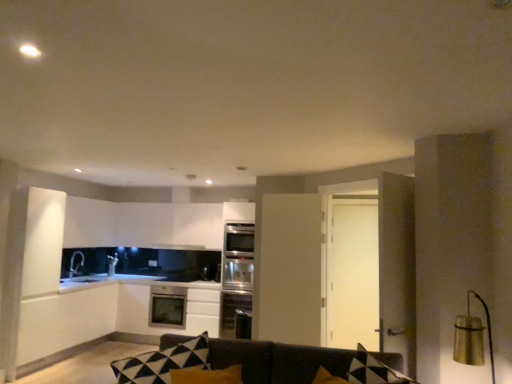
Describe the element at coordinates (167, 306) in the screenshot. I see `satin silver dishwasher at center` at that location.

Where is `satin silver dishwasher at center`? satin silver dishwasher at center is located at coordinates (167, 306).

This screenshot has width=512, height=384. What do you see at coordinates (472, 337) in the screenshot?
I see `gold metallic lampshade at right` at bounding box center [472, 337].

Measure the distance between point (468, 324) and camera.

Point (468, 324) is 8.06 feet from camera.

The image size is (512, 384). What do you see at coordinates (238, 257) in the screenshot?
I see `satin silver oven at center` at bounding box center [238, 257].

What do you see at coordinates (207, 272) in the screenshot? I see `satin black microwave at center` at bounding box center [207, 272].

I want to click on satin silver dishwasher at center, so click(x=167, y=306).

Find the location of a particular element. This screenshot has height=384, width=512. studio couch that is above the satin black microwave at center (from the image's perspective) is located at coordinates (274, 360).

Looking at this image, which is correct: satin black microwave at center is inside dark gray fabric couch at center, or outside of it?

satin black microwave at center is not enclosed by dark gray fabric couch at center.

From a real-world perspective, is satin black microwave at center located beneath dark gray fabric couch at center?

Actually, satin black microwave at center is physically above dark gray fabric couch at center in the real world.

From the image's perspective, which object appears higher, satin black microwave at center or dark gray fabric couch at center?

dark gray fabric couch at center, from the image's perspective.

Between black matte exhaust hood at upper center and satin white oven at center, which one is positioned behind?

black matte exhaust hood at upper center is more distant.

Is black matte exhaust hood at upper center oriented away from satin white oven at center?

That's not correct — black matte exhaust hood at upper center is not looking away from satin white oven at center.

Is black matte exhaust hood at upper center at the right side of satin white oven at center?

Correct, you'll find black matte exhaust hood at upper center to the right of satin white oven at center.

Between black matte exhaust hood at upper center and satin white oven at center, which one has larger size?

With larger size is satin white oven at center.

Would you say satin white oven at center is to the left or to the right of dark gray fabric couch at center in the picture?

satin white oven at center is positioned on dark gray fabric couch at center's left side.

From a real-world perspective, is satin white oven at center above or below dark gray fabric couch at center?

From a real-world perspective, satin white oven at center is physically below dark gray fabric couch at center.

Would you consider gold metallic lampshade at right to be distant from satin silver dishwasher at center?

gold metallic lampshade at right is far away from satin silver dishwasher at center.

This screenshot has height=384, width=512. What are the coordinates of `dish washer below the gold metallic lampshade at right (from a real-world perspective)` in the screenshot? It's located at (167, 306).

Is gold metallic lampshade at right inside the boundaries of satin silver dishwasher at center, or outside?

The correct answer is: outside.

From the image's perspective, between gold metallic lampshade at right and satin silver dishwasher at center, which one is located above?

gold metallic lampshade at right.

From a real-world perspective, who is located lower, gold metallic lampshade at right or satin black microwave at center?

satin black microwave at center is physically lower.

Which is in front, point (469, 352) or point (210, 277)?

Positioned in front is point (469, 352).

Considering the sizes of gold metallic lampshade at right and satin black microwave at center in the image, is gold metallic lampshade at right taller or shorter than satin black microwave at center?

Clearly, gold metallic lampshade at right is taller compared to satin black microwave at center.

Between gold metallic lampshade at right and satin black microwave at center, which one appears on the left side from the viewer's perspective?

From the viewer's perspective, satin black microwave at center appears more on the left side.

Which object is thinner, satin silver oven at center or black matte exhaust hood at upper center?

Thinner between the two is black matte exhaust hood at upper center.

From a real-world perspective, is satin silver oven at center on top of black matte exhaust hood at upper center?

No, from a real-world perspective, satin silver oven at center is not over black matte exhaust hood at upper center

Consider the image. Based on their positions, is satin silver oven at center located to the left or right of black matte exhaust hood at upper center?

In the image, satin silver oven at center appears on the right side of black matte exhaust hood at upper center.

Does point (231, 228) come farther from viewer compared to point (193, 249)?

Yes.

Considering the positions of points (174, 293) and (210, 275), is point (174, 293) farther from camera compared to point (210, 275)?

No, it is in front of (210, 275).

At what (x,y) coordinates should I click in order to perform the action: click on dish washer below the satin black microwave at center (from the image's perspective). Please return your answer as a coordinate pair (x, y). This screenshot has width=512, height=384. Looking at the image, I should click on (167, 306).

Would you say satin silver dishwasher at center is outside satin black microwave at center?

Yes.

The image size is (512, 384). Identify the location of studio couch below the satin black microwave at center (from a real-world perspective). (x=274, y=360).

I want to click on cabinetry below the black matte exhaust hood at upper center (from the image's perspective), so click(167, 325).

Based on their spatial positions, is gold metallic lampshade at right or satin silver dishwasher at center further from satin white oven at center?

Based on the image, gold metallic lampshade at right appears to be further to satin white oven at center.

Looking at the image, which one is located further to satin white oven at center, satin silver dishwasher at center or black matte exhaust hood at upper center?

Among the two, black matte exhaust hood at upper center is located further to satin white oven at center.

Which object lies further to the anchor point satin silver dishwasher at center, gold metallic lampshade at right or satin silver oven at center?

gold metallic lampshade at right is further to satin silver dishwasher at center.

Based on their spatial positions, is black matte exhaust hood at upper center or satin white oven at center further from satin silver dishwasher at center?

black matte exhaust hood at upper center.

Based on their spatial positions, is satin silver dishwasher at center or black matte exhaust hood at upper center closer to satin silver oven at center?

black matte exhaust hood at upper center is closer to satin silver oven at center.

Considering their positions, is satin white oven at center positioned closer to dark gray fabric couch at center than satin silver oven at center?

Based on the image, satin white oven at center appears to be nearer to dark gray fabric couch at center.

Which object lies further to the anchor point satin black microwave at center, satin white oven at center or dark gray fabric couch at center?

Among the two, dark gray fabric couch at center is located further to satin black microwave at center.

When comparing their distances from satin black microwave at center, does gold metallic lampshade at right or satin white oven at center seem further?

Among the two, gold metallic lampshade at right is located further to satin black microwave at center.

The image size is (512, 384). Identify the location of light fixture between dark gray fabric couch at center and satin silver oven at center along the z-axis. (472, 337).

Locate an element on the screen. The width and height of the screenshot is (512, 384). oven located between dark gray fabric couch at center and satin black microwave at center in the depth direction is located at coordinates (238, 257).

Where is `dish washer between gold metallic lampshade at right and satin black microwave at center along the z-axis`? The height and width of the screenshot is (384, 512). dish washer between gold metallic lampshade at right and satin black microwave at center along the z-axis is located at coordinates (167, 306).

Where is `oven located between dark gray fabric couch at center and satin white oven at center in the depth direction`? The width and height of the screenshot is (512, 384). oven located between dark gray fabric couch at center and satin white oven at center in the depth direction is located at coordinates (238, 257).